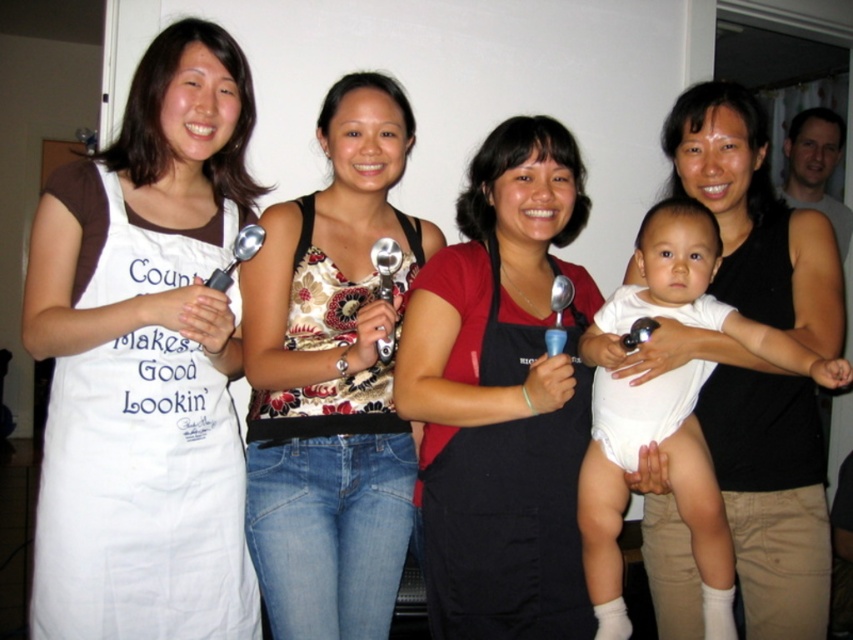
You are a photographer trying to capture a candid shot of the black matte apron at center and the white cloth diaper at center. Since you want to ensure both are fully visible in the frame, which object should you focus on first to avoid cropping either?

The black matte apron at center is not as tall as the white cloth diaper at center, so you should focus on the white cloth diaper at center first to ensure it fits entirely within the frame without being cut off.

You are a photographer adjusting your camera settings to focus on the floral fabric tank top at center and the black matte apron at center. Which one should you focus on first to ensure both are in sharp focus?

You should focus on the floral fabric tank top at center first because it is closer to the viewer than the black matte apron at center, so focusing on the closer object first will help ensure both are in focus.

You are a photographer taking a group photo of the floral fabric tank top at center and the white cotton apron at left. Which person should you position higher in the frame to ensure both are visible equally?

The photographer should position the white cotton apron at left higher in the frame because the floral fabric tank top at center is much taller than the white cotton apron at left, so raising the shorter person will balance their visibility.